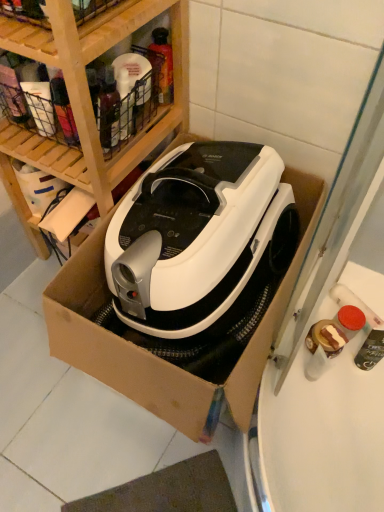
Question: Could you tell me if translucent plastic spray bottle at upper center is turned towards white cardboard box at center?

Choices:
 (A) no
 (B) yes

Answer: (A)

Question: Is translucent plastic spray bottle at upper center wider than white cardboard box at center?

Choices:
 (A) yes
 (B) no

Answer: (B)

Question: Does translucent plastic spray bottle at upper center have a greater height compared to white cardboard box at center?

Choices:
 (A) yes
 (B) no

Answer: (B)

Question: Is translucent plastic spray bottle at upper center in front of white cardboard box at center?

Choices:
 (A) no
 (B) yes

Answer: (A)

Question: From a real-world perspective, is translucent plastic spray bottle at upper center physically above white cardboard box at center?

Choices:
 (A) no
 (B) yes

Answer: (B)

Question: From a real-world perspective, is translucent plastic spray bottle at upper center positioned under white cardboard box at center based on gravity?

Choices:
 (A) yes
 (B) no

Answer: (B)

Question: From the image's perspective, is translucent plastic spray bottle at upper center above wooden at upper left?

Choices:
 (A) no
 (B) yes

Answer: (B)

Question: From a real-world perspective, does translucent plastic spray bottle at upper center sit lower than wooden at upper left?

Choices:
 (A) yes
 (B) no

Answer: (B)

Question: Does translucent plastic spray bottle at upper center appear on the left side of wooden at upper left?

Choices:
 (A) yes
 (B) no

Answer: (B)

Question: Is translucent plastic spray bottle at upper center smaller than wooden at upper left?

Choices:
 (A) yes
 (B) no

Answer: (A)

Question: From the image's perspective, is translucent plastic spray bottle at upper center under wooden at upper left?

Choices:
 (A) yes
 (B) no

Answer: (B)

Question: Considering the relative sizes of translucent plastic spray bottle at upper center and wooden at upper left in the image provided, is translucent plastic spray bottle at upper center taller than wooden at upper left?

Choices:
 (A) no
 (B) yes

Answer: (A)

Question: From the image's perspective, is white cardboard box at center under translucent plastic spray bottle at upper center?

Choices:
 (A) no
 (B) yes

Answer: (B)